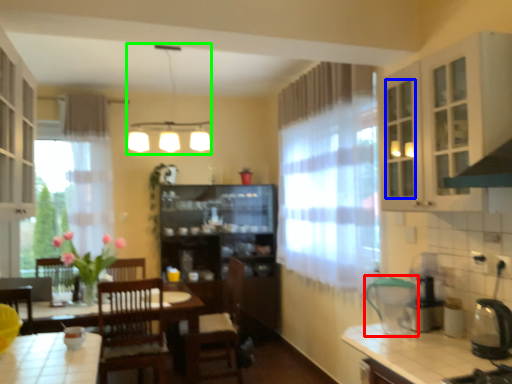
Question: Which object is positioned closest to appliance (highlighted by a red box)? Select from glass door (highlighted by a blue box) and light fixture (highlighted by a green box).

Choices:
 (A) glass door
 (B) light fixture

Answer: (A)